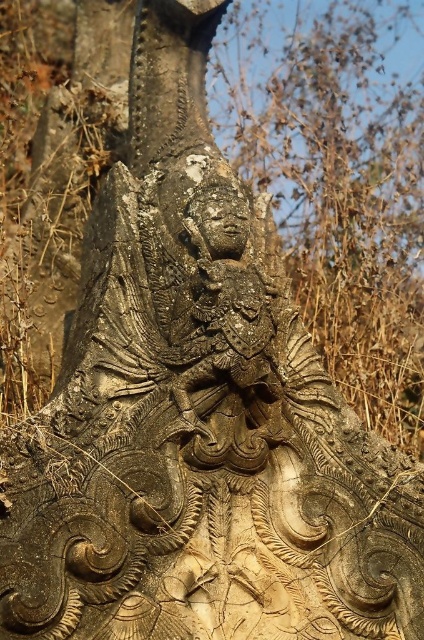
Looking at the carved stone sculpture, there are two main features at the center. The first is the carved stone deity at center and the carved stone face at center. Which one is positioned to the right side?

The carved stone deity at center is positioned to the right of the carved stone face at center.

You are an archaeologist examining the stone sculpture. You notice a specific point marked at coordinates [225,301]. What does this point indicate on the sculpture?

The point at coordinates [225,301] marks the carved stone deity at the center of the sculpture.

You are an archaeologist examining the stone sculpture. You notice two points on the carving. The first point is at coordinates point (194, 216) and the second is at point (248, 230). Based on your observation, which point is closer to you?

Point (194, 216) is in front of point (248, 230), so the first point is closer to you.